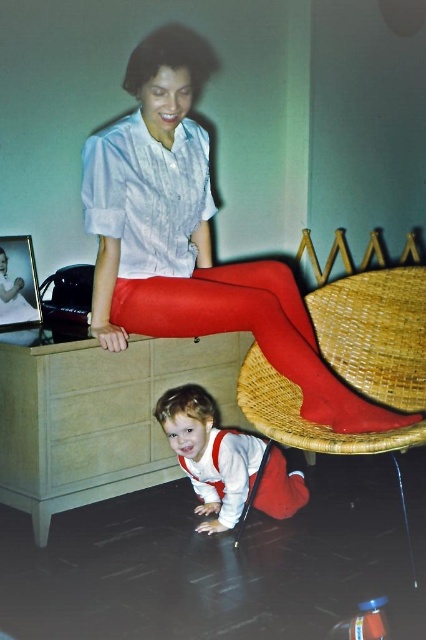
Who is taller, woven wood chair at lower center or white cotton onesie at lower center?

woven wood chair at lower center

Who is positioned more to the left, woven wood chair at lower center or white cotton onesie at lower center?

white cotton onesie at lower center is more to the left.

Image resolution: width=426 pixels, height=640 pixels. I want to click on woven wood chair at lower center, so click(x=371, y=323).

Does matte red skirt at upper center have a lesser width compared to matte red tights at lower center?

No, matte red skirt at upper center is not thinner than matte red tights at lower center.

Is matte red skirt at upper center to the left of matte red tights at lower center from the viewer's perspective?

Correct, you'll find matte red skirt at upper center to the left of matte red tights at lower center.

Between point (271, 284) and point (195, 320), which one is positioned behind?

The point (271, 284) is more distant.

Find the location of `matte red skirt at upper center`. matte red skirt at upper center is located at coordinates (192, 243).

Is point (371, 404) farther from viewer compared to point (288, 500)?

No.

Does matte red tights at lower center have a larger size compared to white cotton onesie at lower center?

Correct, matte red tights at lower center is larger in size than white cotton onesie at lower center.

The width and height of the screenshot is (426, 640). Identify the location of matte red tights at lower center. 253,332.